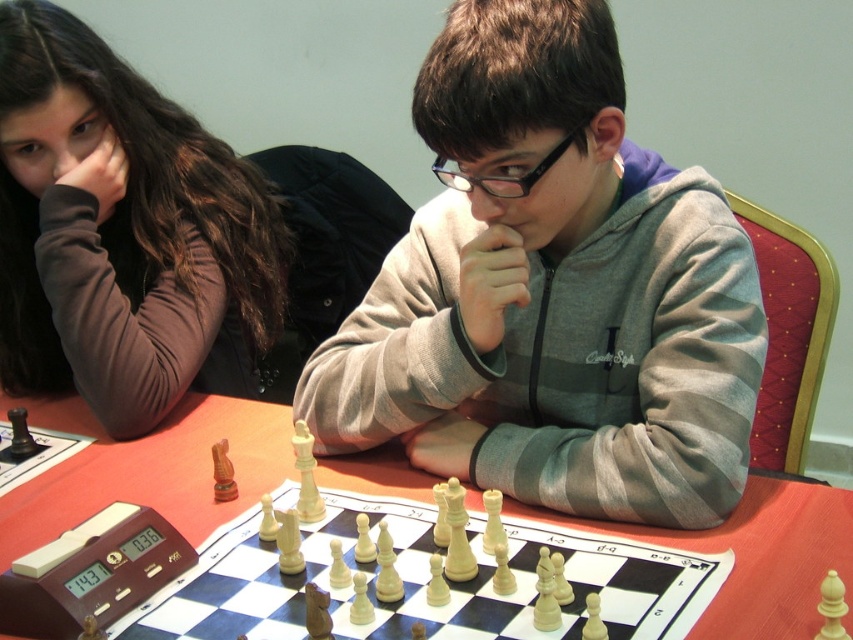
Based on the photo, you are a photographer trying to capture a closeup of the gray fleece hoodie at center and the matte brown hair at upper left. Since you can only focus on one subject at a time, which one should you choose to ensure it appears sharp in the photo?

The gray fleece hoodie at center is to the right of matte brown hair at upper left, so you should focus on the matte brown hair at upper left to ensure it appears sharp in the photo.

You are looking at the chessboard and need to determine which of the two points, point (x=740, y=468) or point (x=161, y=364), is nearer to you. Based on the coordinates provided, which one is closer?

Point (x=740, y=468) is closer to the camera than point (x=161, y=364).